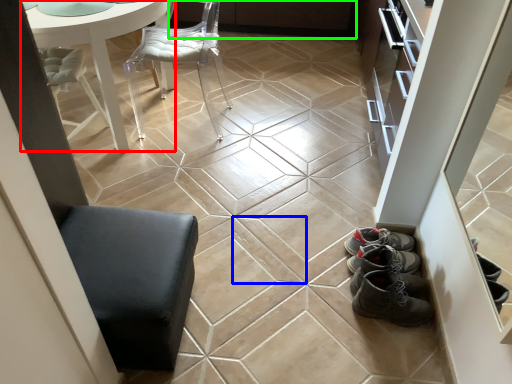
Question: Considering the real-world distances, which object is closest to table (highlighted by a red box)? ceramic tile (highlighted by a blue box) or cabinetry (highlighted by a green box).

Choices:
 (A) ceramic tile
 (B) cabinetry

Answer: (A)